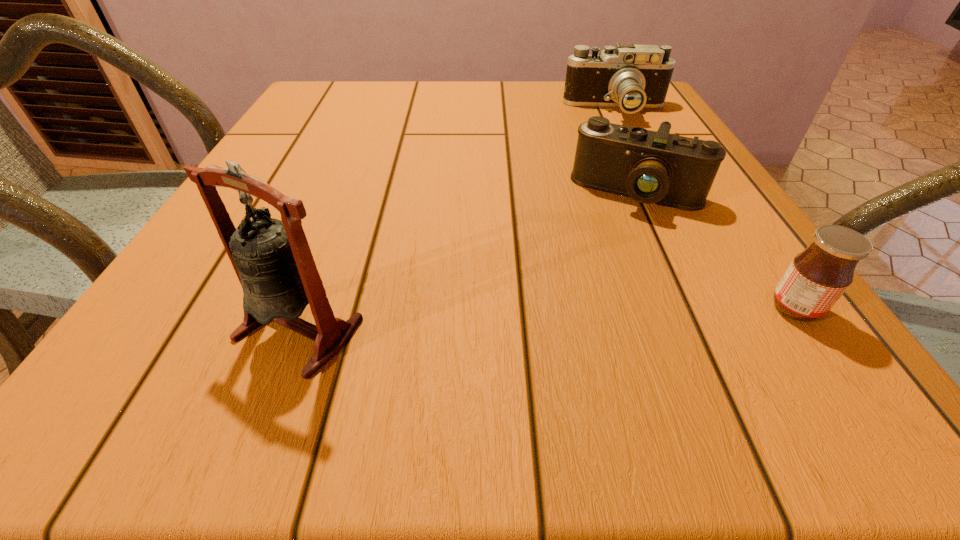
This screenshot has height=540, width=960. What are the coordinates of `the tallest object` in the screenshot? It's located at (272, 259).

Where is `bell`? The height and width of the screenshot is (540, 960). bell is located at coordinates (272, 259).

Find the location of a particular element. The height and width of the screenshot is (540, 960). jam is located at coordinates (817, 277).

You are a GUI agent. You are given a task and a screenshot of the screen. Output one action in this format:
    pyautogui.click(x=<x>, y=<y>)
    Task: Click on the farthest object
    
    Given the screenshot: What is the action you would take?
    pyautogui.click(x=633, y=77)

Locate an element on the screen. The image size is (960, 540). the nearer camera is located at coordinates (650, 167).

This screenshot has height=540, width=960. Find the location of `vacant space located 0.110m on the back of the bell`. vacant space located 0.110m on the back of the bell is located at coordinates (332, 240).

Find the location of a particular element. The height and width of the screenshot is (540, 960). blank space located 0.090m at the lens of the farthest object is located at coordinates (612, 143).

This screenshot has height=540, width=960. Identify the location of free region located at the lens of the farthest object. (612, 141).

I want to click on vacant space positioned 0.240m at the lens of the farthest object, so click(x=611, y=179).

This screenshot has height=540, width=960. What are the coordinates of `vacant space located 0.270m on the lens of the second farthest object` in the screenshot? It's located at (577, 326).